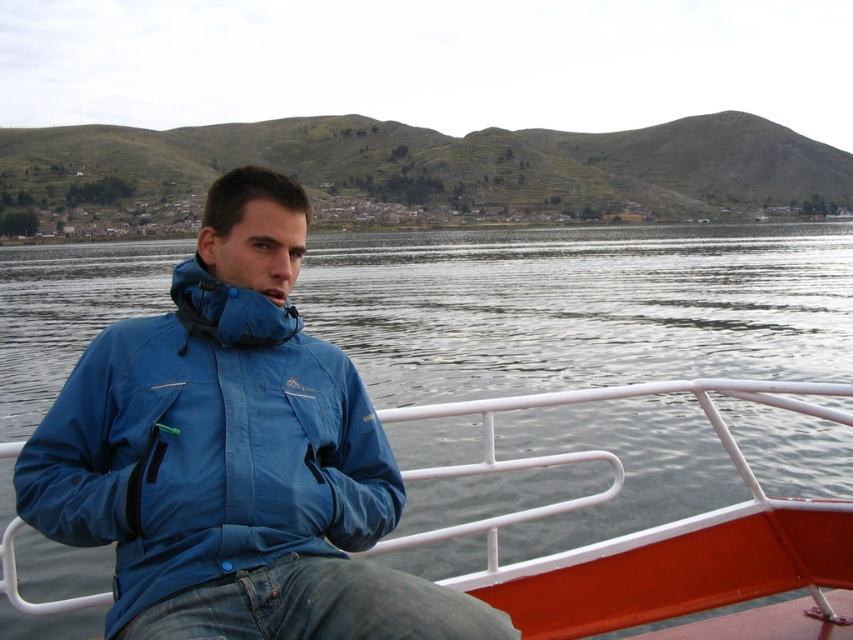
Which is above, blue waterproof jacket at center or blue fabric boat at center?

Positioned higher is blue waterproof jacket at center.

Where is `blue waterproof jacket at center`? blue waterproof jacket at center is located at coordinates (207, 445).

Where is `blue waterproof jacket at center`? The width and height of the screenshot is (853, 640). blue waterproof jacket at center is located at coordinates (207, 445).